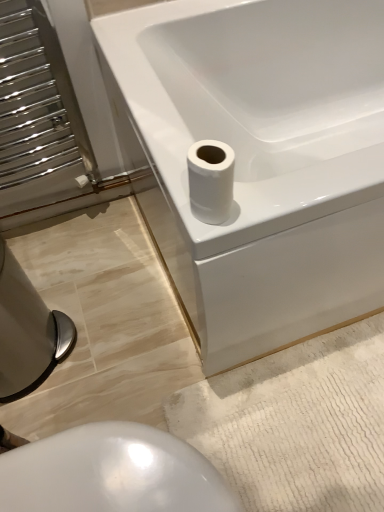
Identify the location of unoccupied space behind white glossy toilet paper at upper right. The width and height of the screenshot is (384, 512). (171, 147).